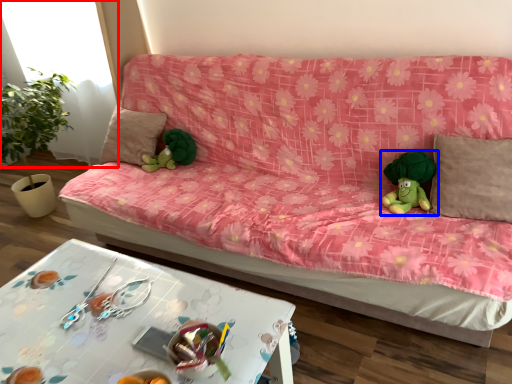
Question: Which of the following is the farthest to the observer, window (highlighted by a red box) or toy (highlighted by a blue box)?

Choices:
 (A) window
 (B) toy

Answer: (A)